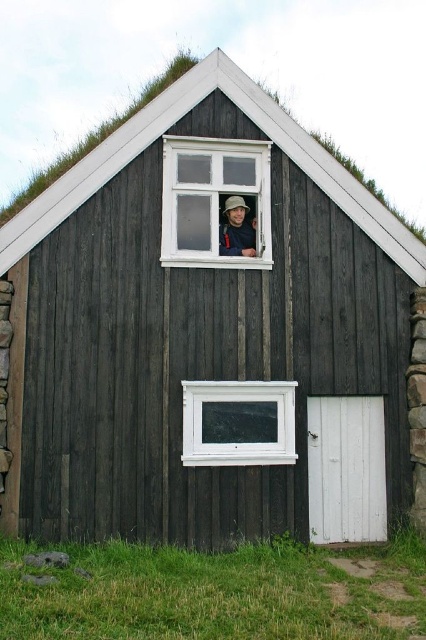
Is white wood window at upper center closer to camera compared to matte black hat at upper center?

Yes.

Is the position of white wood window at upper center more distant than that of matte black hat at upper center?

No, white wood window at upper center is closer to the viewer.

At what (x,y) coordinates should I click in order to perform the action: click on white wood window at upper center. Please return your answer as a coordinate pair (x, y). Looking at the image, I should click on (213, 198).

Can you confirm if white plastic window at lower center is taller than matte black hat at upper center?

Correct, white plastic window at lower center is much taller as matte black hat at upper center.

Between point (293, 396) and point (252, 234), which one is positioned in front?

Point (293, 396)

This screenshot has height=640, width=426. What are the coordinates of `white plastic window at lower center` in the screenshot? It's located at (238, 422).

Between point (213, 237) and point (282, 404), which one is positioned behind?

The point (213, 237) is behind.

Does white wood window at upper center appear over white plastic window at lower center?

Indeed, white wood window at upper center is positioned over white plastic window at lower center.

Is point (207, 252) positioned in front of point (195, 413)?

No, it is behind (195, 413).

At what (x,y) coordinates should I click in order to perform the action: click on white wood window at upper center. Please return your answer as a coordinate pair (x, y). This screenshot has height=640, width=426. Looking at the image, I should click on (213, 198).